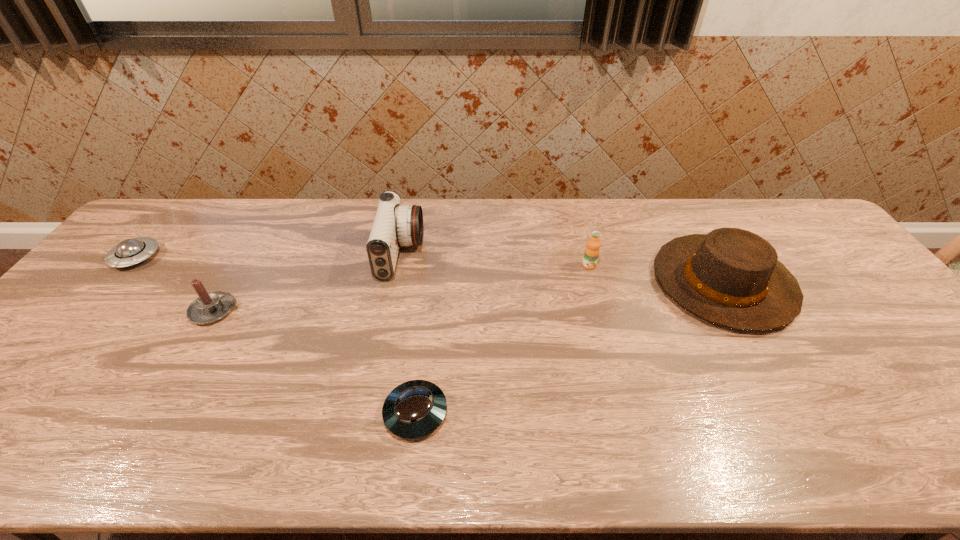
Where is `free space between the second object from left to right and the camcorder`? free space between the second object from left to right and the camcorder is located at coordinates (308, 282).

Locate an element on the screen. free spot between the orange juice and the second object from left to right is located at coordinates (402, 288).

At what (x,y) coordinates should I click in order to perform the action: click on vacant region between the rightmost object and the right saucer. Please return your answer as a coordinate pair (x, y). Looking at the image, I should click on (569, 348).

You are a GUI agent. You are given a task and a screenshot of the screen. Output one action in this format:
    pyautogui.click(x=<x>, y=<y>)
    Task: Click on the object identified as the closest to the right saucer
    Image resolution: width=960 pixels, height=540 pixels.
    Given the screenshot: What is the action you would take?
    pyautogui.click(x=394, y=225)

Find the location of a particular element. The image size is (960, 540). object that is the fifth closest to the farther saucer is located at coordinates (731, 277).

Where is `free space in the image that satisfies the following two spatial constraints: 1. on the surface of the camcorder; 2. on the back side of the rightmost object`? free space in the image that satisfies the following two spatial constraints: 1. on the surface of the camcorder; 2. on the back side of the rightmost object is located at coordinates (396, 283).

I want to click on free region that satisfies the following two spatial constraints: 1. on the back side of the shortest object; 2. on the right side of the cowboy hat, so click(430, 283).

Locate an element on the screen. blank area in the image that satisfies the following two spatial constraints: 1. on the label of the fifth object from left to right; 2. on the side of the candle with the handle loop is located at coordinates (601, 310).

Identify the location of vacant area in the image that satisfies the following two spatial constraints: 1. on the front side of the rightmost object; 2. on the side of the candle with the handle loop. This screenshot has height=540, width=960. (738, 310).

The width and height of the screenshot is (960, 540). I want to click on vacant area in the image that satisfies the following two spatial constraints: 1. on the surface of the camcorder; 2. on the front side of the second shortest object, so [400, 258].